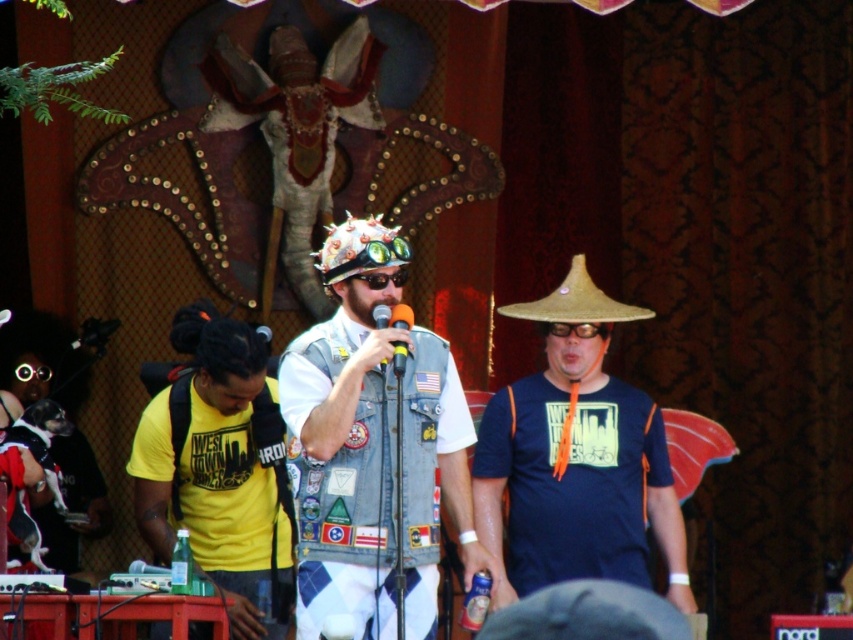
Who is more distant from viewer, (312,397) or (376,314)?

Point (376,314)

Does denim vest at center appear over metallic silver microphone at center?

No.

Is point (410, 448) farther from viewer compared to point (380, 364)?

Yes, point (410, 448) is behind point (380, 364).

Identify the location of denim vest at center. (340, 483).

The width and height of the screenshot is (853, 640). Describe the element at coordinates (215, 492) in the screenshot. I see `yellow cotton t-shirt at left` at that location.

Who is more forward, [262,499] or [399,308]?

Positioned in front is point [399,308].

Is point (140, 417) closer to camera compared to point (404, 353)?

No, it is not.

Where is `yellow cotton t-shirt at left`? This screenshot has height=640, width=853. yellow cotton t-shirt at left is located at coordinates (215, 492).

Who is more forward, (605, 490) or (390, 316)?

Point (390, 316)

Who is higher up, dark blue cotton t-shirt at center or metallic silver microphone at center?

metallic silver microphone at center

Between point (537, 483) and point (384, 369), which one is positioned in front?

Positioned in front is point (384, 369).

Find the location of a particular element. The width and height of the screenshot is (853, 640). dark blue cotton t-shirt at center is located at coordinates coord(572,481).